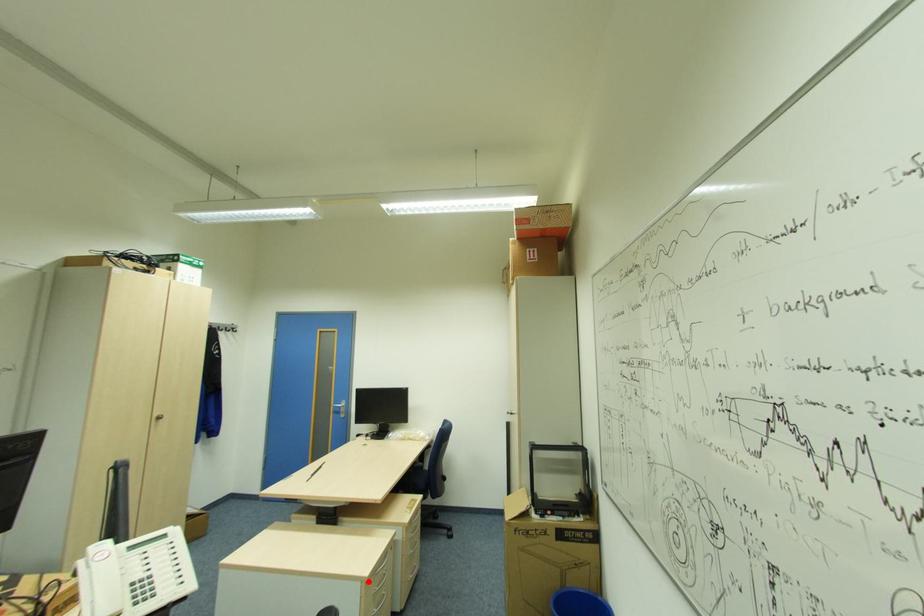
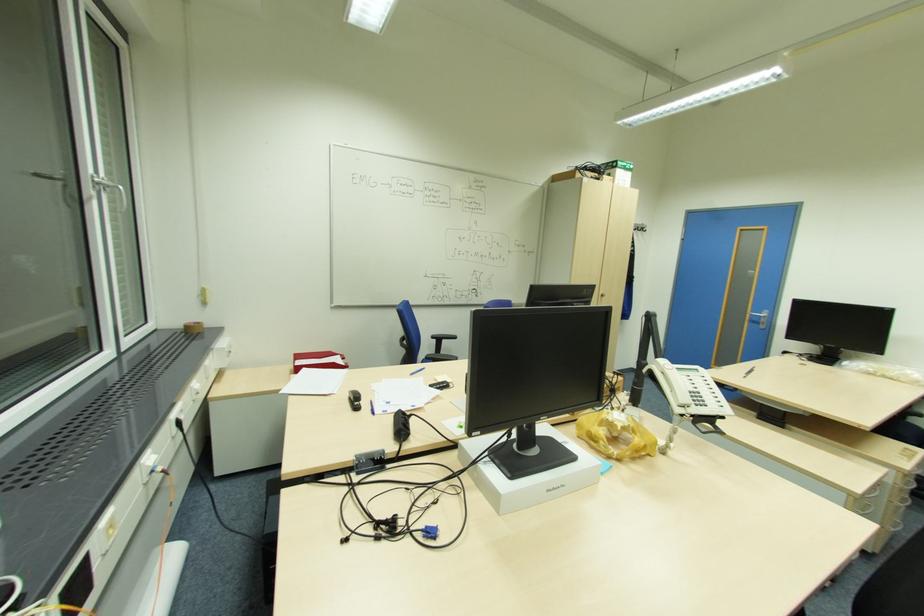
Question: I am providing you with two images of the same scene from different viewpoints. In image1, a red point is highlighted. Considering the same 3D point in image2, which of the following is correct?

Choices:
 (A) It is closer
 (B) It is farther

Answer: (B)